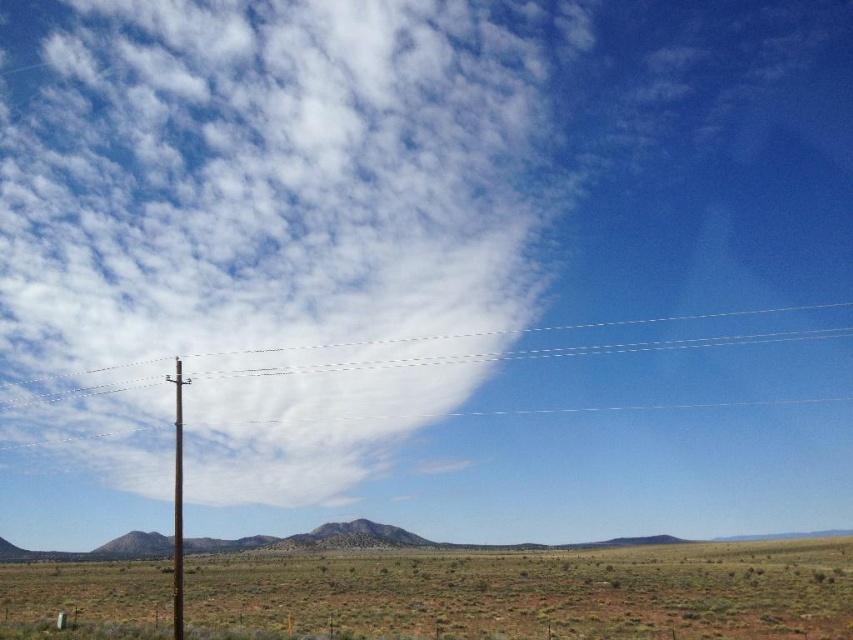
Is white fluffy cloud at upper center positioned in front of smooth brown pole at center?

No, white fluffy cloud at upper center is further to the viewer.

Is white fluffy cloud at upper center to the right of smooth brown pole at center from the viewer's perspective?

Incorrect, white fluffy cloud at upper center is not on the right side of smooth brown pole at center.

Find the location of a particular element. white fluffy cloud at upper center is located at coordinates (273, 221).

Locate an element on the screen. Image resolution: width=853 pixels, height=640 pixels. white fluffy cloud at upper center is located at coordinates (273, 221).

Between white fluffy cloud at upper center and green matte grassland at lower center, which one appears on the left side from the viewer's perspective?

white fluffy cloud at upper center

Who is more forward, (97, 49) or (224, 592)?

Positioned in front is point (224, 592).

Is point (276, 353) farther from camera compared to point (273, 580)?

Yes, point (276, 353) is farther from viewer.

This screenshot has height=640, width=853. Find the location of `white fluffy cloud at upper center`. white fluffy cloud at upper center is located at coordinates point(273,221).

Where is `green matte grassland at lower center`? The height and width of the screenshot is (640, 853). green matte grassland at lower center is located at coordinates (532, 593).

Does green matte grassland at lower center lie behind smooth brown pole at center?

Yes, it is behind smooth brown pole at center.

Describe the element at coordinates (532, 593) in the screenshot. The image size is (853, 640). I see `green matte grassland at lower center` at that location.

Locate an element on the screen. The height and width of the screenshot is (640, 853). green matte grassland at lower center is located at coordinates (532, 593).